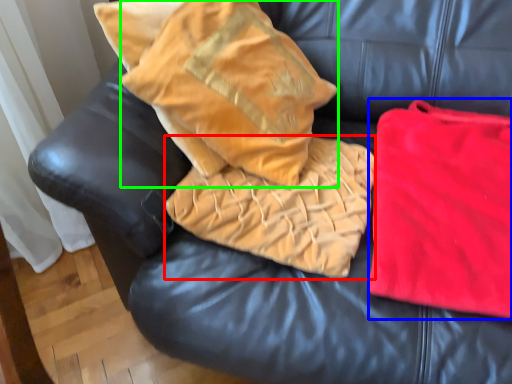
Question: Which object is positioned farthest from cloth (highlighted by a red box)? Select from material (highlighted by a blue box) and throw pillow (highlighted by a green box).

Choices:
 (A) material
 (B) throw pillow

Answer: (A)